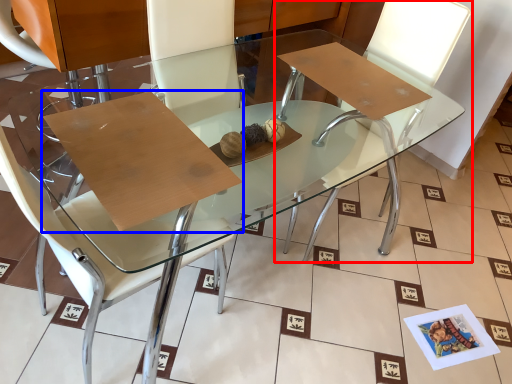
Question: Which object appears closest to the camera in this image, chair (highlighted by a red box) or cardboard (highlighted by a blue box)?

Choices:
 (A) chair
 (B) cardboard

Answer: (B)